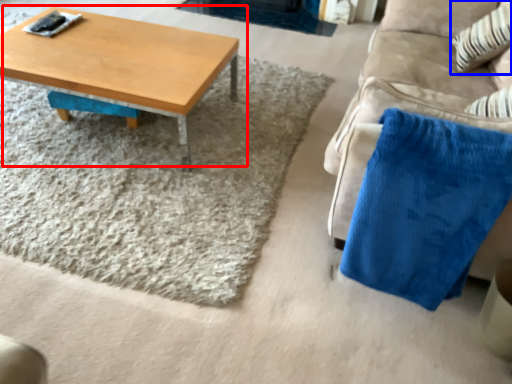
Question: Which object appears farthest to the camera in this image, coffee table (highlighted by a red box) or throw pillow (highlighted by a blue box)?

Choices:
 (A) coffee table
 (B) throw pillow

Answer: (B)